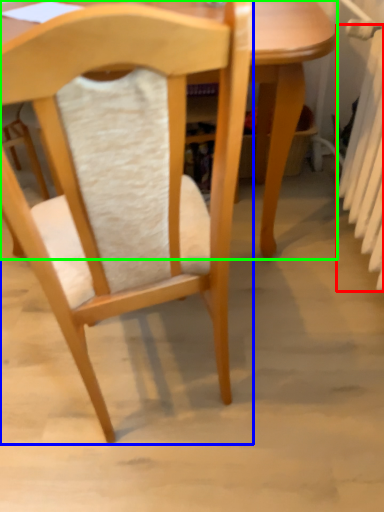
Question: Which object is the closest to the radiator (highlighted by a red box)? Choose among these: chair (highlighted by a blue box) or table (highlighted by a green box).

Choices:
 (A) chair
 (B) table

Answer: (B)